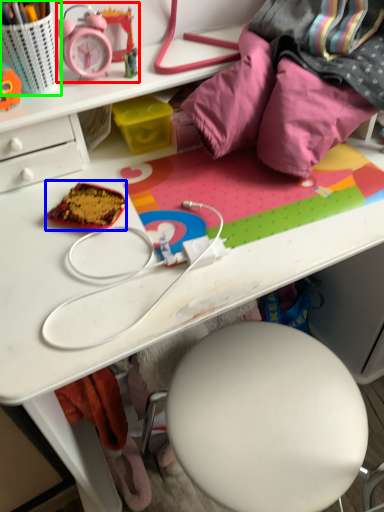
Question: Considering the real-world distances, which object is closest to stationery (highlighted by a red box)? stuff (highlighted by a blue box) or stationery (highlighted by a green box).

Choices:
 (A) stuff
 (B) stationery

Answer: (B)